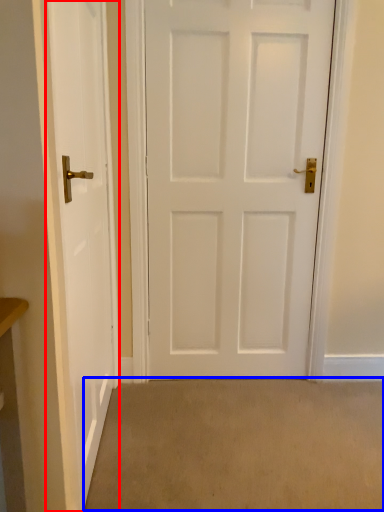
Question: Which object appears farthest to the camera in this image, door (highlighted by a red box) or plain (highlighted by a blue box)?

Choices:
 (A) door
 (B) plain

Answer: (B)